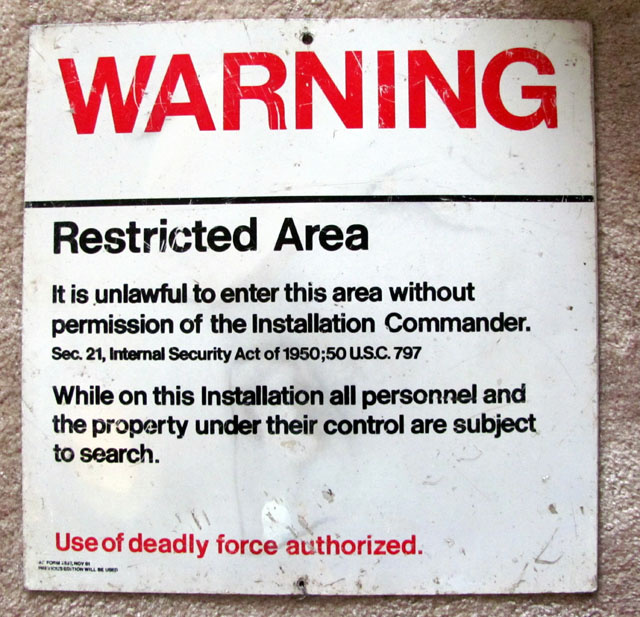
This screenshot has width=640, height=617. Identify the location of carpet space to the left of sign. (6, 348).